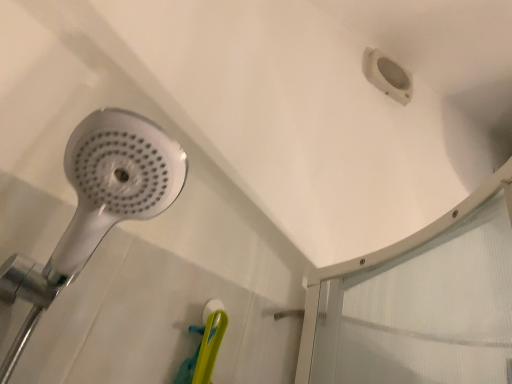
The width and height of the screenshot is (512, 384). I want to click on white plastic hole at upper right, so click(x=388, y=75).

The image size is (512, 384). What do you see at coordinates (388, 75) in the screenshot? I see `white plastic hole at upper right` at bounding box center [388, 75].

Image resolution: width=512 pixels, height=384 pixels. Identify the location of white plastic hole at upper right. (388, 75).